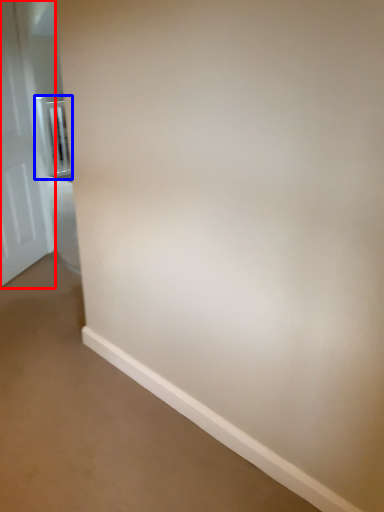
Question: Among these objects, which one is nearest to the camera, door (highlighted by a red box) or balustrade (highlighted by a blue box)?

Choices:
 (A) door
 (B) balustrade

Answer: (A)